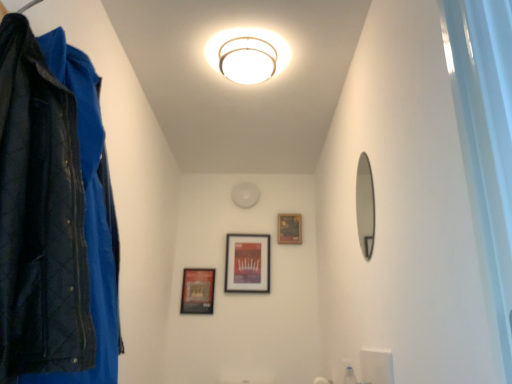
Where is `matte black picture frame at center, which ranks as the first picture frame in right-to-left order`? matte black picture frame at center, which ranks as the first picture frame in right-to-left order is located at coordinates (289, 229).

The image size is (512, 384). What are the coordinates of `white glossy light at center` in the screenshot? It's located at (245, 194).

Where is `white glossy light fixture at upper center`? white glossy light fixture at upper center is located at coordinates (248, 54).

Is white glossy light fixture at upper center with transparent plastic bottle at lower right?

white glossy light fixture at upper center and transparent plastic bottle at lower right are clearly separated.

Is point (228, 59) closer to camera compared to point (349, 372)?

Yes, point (228, 59) is in front of point (349, 372).

From the image's perspective, would you say white glossy light fixture at upper center is shown under transparent plastic bottle at lower right?

Actually, white glossy light fixture at upper center appears above transparent plastic bottle at lower right in the image.

From a real-world perspective, who is located higher, white glossy light fixture at upper center or transparent plastic bottle at lower right?

From a 3D spatial view, white glossy light fixture at upper center is above.

Is matte black picture frame at center, which is the third picture frame from left to right, located within black matte picture frame at center, the 2th picture frame from the left?

No, black matte picture frame at center, the 2th picture frame from the left, does not contain matte black picture frame at center, which is the third picture frame from left to right.

Which point is more distant from viewer, (267,255) or (284,218)?

The point (284,218) is behind.

How much distance is there between black matte picture frame at center, marked as the 2th picture frame in a right-to-left arrangement, and matte black picture frame at center, which ranks as the first picture frame in right-to-left order?

black matte picture frame at center, marked as the 2th picture frame in a right-to-left arrangement, and matte black picture frame at center, which ranks as the first picture frame in right-to-left order, are 11.35 inches apart from each other.

Could you tell me if black matte picture frame at center, the 2th picture frame from the left, is turned towards matte black picture frame at center, which is the third picture frame from left to right?

No, black matte picture frame at center, the 2th picture frame from the left, is not facing towards matte black picture frame at center, which is the third picture frame from left to right.

Does smooth silver mirror at right turn towards black matte picture frame at center, the 2th picture frame from the left?

No, smooth silver mirror at right is not oriented towards black matte picture frame at center, the 2th picture frame from the left.

From a real-world perspective, which object stands above the other?

black matte picture frame at center, marked as the 2th picture frame in a right-to-left arrangement, from a real-world perspective.

Between smooth silver mirror at right and black matte picture frame at center, marked as the 2th picture frame in a right-to-left arrangement, which one has smaller width?

smooth silver mirror at right is thinner.

Is smooth silver mirror at right outside of black matte picture frame at center, the 2th picture frame from the left?

Indeed, smooth silver mirror at right is completely outside black matte picture frame at center, the 2th picture frame from the left.

Considering the sizes of objects matte black picture frame at center, which is the third picture frame from left to right, and white glossy light fixture at upper center in the image provided, who is thinner, matte black picture frame at center, which is the third picture frame from left to right, or white glossy light fixture at upper center?

matte black picture frame at center, which is the third picture frame from left to right, is thinner.

Is matte black picture frame at center, which is the third picture frame from left to right, touching white glossy light fixture at upper center?

matte black picture frame at center, which is the third picture frame from left to right, and white glossy light fixture at upper center are clearly separated.

From a real-world perspective, is matte black picture frame at center, which is the third picture frame from left to right, positioned above or below white glossy light fixture at upper center?

From a real-world perspective, matte black picture frame at center, which is the third picture frame from left to right, is physically below white glossy light fixture at upper center.

Consider the image. Is matte black picture frame at center, which is the third picture frame from left to right, surrounding white glossy light fixture at upper center?

No.

Who is more distant, white glossy light at center or transparent plastic bottle at lower right?

white glossy light at center is more distant.

Which of these two, white glossy light at center or transparent plastic bottle at lower right, stands taller?

white glossy light at center.

From a real-world perspective, is white glossy light at center over transparent plastic bottle at lower right?

Yes, from a real-world perspective, white glossy light at center is on top of transparent plastic bottle at lower right.

Is white glossy light at center in contact with transparent plastic bottle at lower right?

No, white glossy light at center is not beside transparent plastic bottle at lower right.

Considering the sizes of objects black matte picture frame at center, the 2th picture frame from the left, and white glossy light at center in the image provided, who is smaller, black matte picture frame at center, the 2th picture frame from the left, or white glossy light at center?

white glossy light at center is smaller.

Is white glossy light at center completely or partially inside black matte picture frame at center, marked as the 2th picture frame in a right-to-left arrangement?

That's incorrect, white glossy light at center is not inside black matte picture frame at center, marked as the 2th picture frame in a right-to-left arrangement.

From a real-world perspective, who is located higher, black matte picture frame at center, marked as the 2th picture frame in a right-to-left arrangement, or white glossy light at center?

In real-world perspective, white glossy light at center is above.

Could you tell me if black matte picture frame at center, the 2th picture frame from the left, is facing white glossy light at center?

No, black matte picture frame at center, the 2th picture frame from the left, is not aimed at white glossy light at center.

Considering the positions of points (185, 294) and (290, 215), is point (185, 294) closer to camera compared to point (290, 215)?

Yes, it is.

Would you say matte black picture frame at lower left, positioned as the third picture frame in right-to-left order, is a long distance from matte black picture frame at center, which ranks as the first picture frame in right-to-left order?

Actually, matte black picture frame at lower left, positioned as the third picture frame in right-to-left order, and matte black picture frame at center, which ranks as the first picture frame in right-to-left order, are a little close together.

From the image's perspective, which object appears higher, matte black picture frame at lower left, which is the 1th picture frame in left-to-right order, or matte black picture frame at center, which is the third picture frame from left to right?

matte black picture frame at center, which is the third picture frame from left to right, is shown above in the image.

Considering the positions of objects matte black picture frame at lower left, positioned as the third picture frame in right-to-left order, and matte black picture frame at center, which is the third picture frame from left to right, in the image provided, who is more to the right, matte black picture frame at lower left, positioned as the third picture frame in right-to-left order, or matte black picture frame at center, which is the third picture frame from left to right,?

Positioned to the right is matte black picture frame at center, which is the third picture frame from left to right.

At what (x,y) coordinates should I click in order to perform the action: click on light fixture on the left of transparent plastic bottle at lower right. Please return your answer as a coordinate pair (x, y). Looking at the image, I should click on (248, 54).

Locate an element on the screen. picture frame above the black matte picture frame at center, the 2th picture frame from the left (from the image's perspective) is located at coordinates (289, 229).

From the image, which object appears to be nearer to smooth silver mirror at right, transparent plastic bottle at lower right or matte black picture frame at lower left, positioned as the third picture frame in right-to-left order?

transparent plastic bottle at lower right.

Based on their spatial positions, is transparent plastic bottle at lower right or black matte picture frame at center, marked as the 2th picture frame in a right-to-left arrangement, further from white glossy light at center?

Among the two, transparent plastic bottle at lower right is located further to white glossy light at center.

Looking at the image, which one is located further to white glossy light fixture at upper center, smooth silver mirror at right or transparent plastic bottle at lower right?

transparent plastic bottle at lower right is further to white glossy light fixture at upper center.

Based on their spatial positions, is black matte picture frame at center, the 2th picture frame from the left, or matte black picture frame at center, which is the third picture frame from left to right, further from white glossy light at center?

The object further to white glossy light at center is black matte picture frame at center, the 2th picture frame from the left.

Which object lies further to the anchor point black matte picture frame at center, marked as the 2th picture frame in a right-to-left arrangement, white glossy light at center or smooth silver mirror at right?

Among the two, smooth silver mirror at right is located further to black matte picture frame at center, marked as the 2th picture frame in a right-to-left arrangement.

From the image, which object appears to be nearer to black matte picture frame at center, the 2th picture frame from the left, smooth silver mirror at right or transparent plastic bottle at lower right?

transparent plastic bottle at lower right.

Which object lies further to the anchor point transparent plastic bottle at lower right, smooth silver mirror at right or black matte picture frame at center, the 2th picture frame from the left?

black matte picture frame at center, the 2th picture frame from the left, is positioned further to the anchor transparent plastic bottle at lower right.

From the image, which object appears to be farther from matte black picture frame at center, which ranks as the first picture frame in right-to-left order, matte black picture frame at lower left, positioned as the third picture frame in right-to-left order, or white glossy light fixture at upper center?

The object further to matte black picture frame at center, which ranks as the first picture frame in right-to-left order, is white glossy light fixture at upper center.

You are a GUI agent. You are given a task and a screenshot of the screen. Output one action in this format:
    pyautogui.click(x=<x>, y=<y>)
    Task: Click on the light fixture located between transparent plastic bottle at lower right and matte black picture frame at lower left, positioned as the third picture frame in right-to-left order, in the depth direction
    
    Given the screenshot: What is the action you would take?
    point(248,54)

The height and width of the screenshot is (384, 512). Identify the location of mirror between white glossy light fixture at upper center and transparent plastic bottle at lower right in the up-down direction. (365, 206).

This screenshot has width=512, height=384. What are the coordinates of `toiletry positioned between smooth silver mirror at right and matte black picture frame at center, which ranks as the first picture frame in right-to-left order, from near to far` in the screenshot? It's located at (349, 376).

At what (x,y) coordinates should I click in order to perform the action: click on light fixture between transparent plastic bottle at lower right and black matte picture frame at center, marked as the 2th picture frame in a right-to-left arrangement, in the front-back direction. Please return your answer as a coordinate pair (x, y). Looking at the image, I should click on (248, 54).